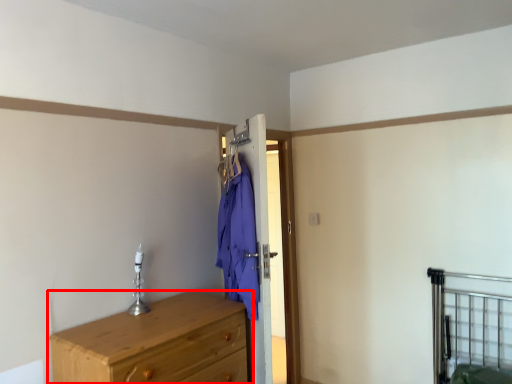
Question: Observing the image, what is the correct spatial positioning of chest of drawers (annotated by the red box) in reference to bed frame?

Choices:
 (A) right
 (B) left

Answer: (B)